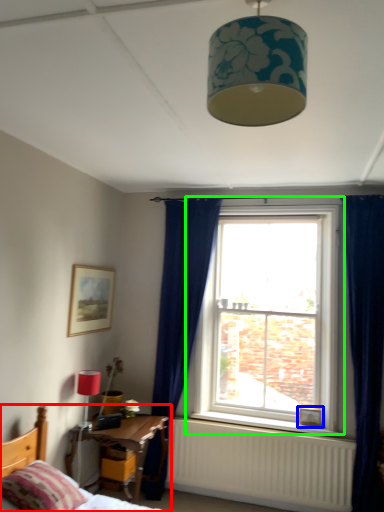
Question: Estimate the real-world distances between objects in this image. Which object is closer to bed (highlighted by a red box), picture frame (highlighted by a blue box) or window (highlighted by a green box)?

Choices:
 (A) picture frame
 (B) window

Answer: (B)